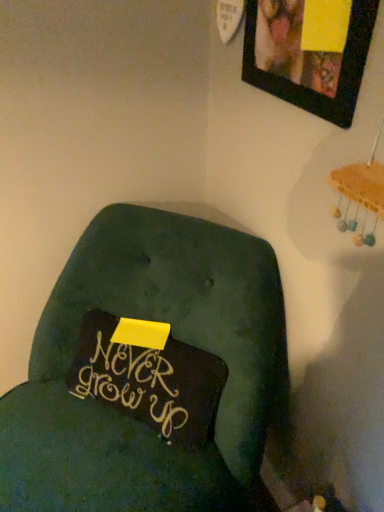
Question: Visually, is velvety green cushion at center positioned to the left or to the right of matte black picture frame at upper right?

Choices:
 (A) right
 (B) left

Answer: (B)

Question: From a real-world perspective, is velvety green cushion at center above or below matte black picture frame at upper right?

Choices:
 (A) above
 (B) below

Answer: (B)

Question: From the image's perspective, relative to matte black picture frame at upper right, is velvety green cushion at center above or below?

Choices:
 (A) below
 (B) above

Answer: (A)

Question: From a real-world perspective, is matte black picture frame at upper right physically located above or below velvety green cushion at center?

Choices:
 (A) below
 (B) above

Answer: (B)

Question: In terms of width, does matte black picture frame at upper right look wider or thinner when compared to velvety green cushion at center?

Choices:
 (A) thin
 (B) wide

Answer: (A)

Question: From the image's perspective, is matte black picture frame at upper right positioned above or below velvety green cushion at center?

Choices:
 (A) above
 (B) below

Answer: (A)

Question: Choose the correct answer: Is matte black picture frame at upper right inside velvety green cushion at center or outside it?

Choices:
 (A) inside
 (B) outside

Answer: (B)